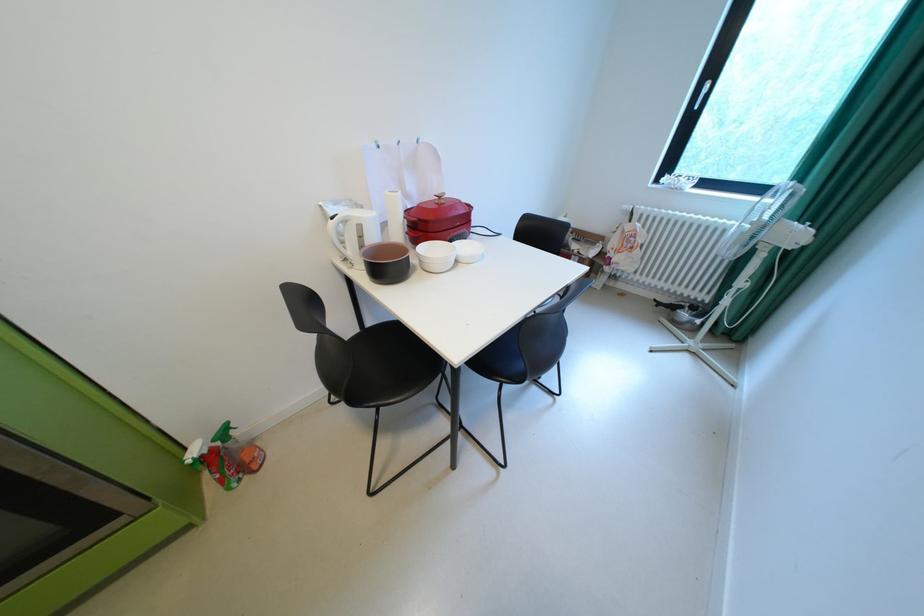
Identify the location of red pot lid handle. (440, 208).